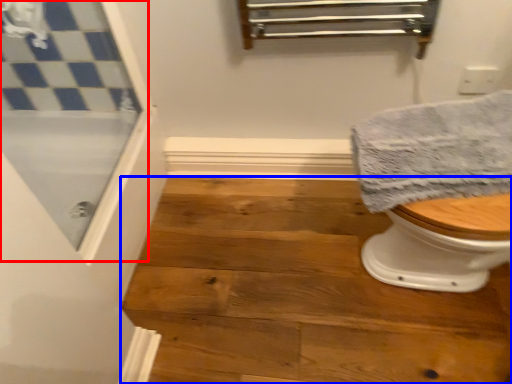
Question: Among these objects, which one is nearest to the camera, screen door (highlighted by a red box) or stair (highlighted by a blue box)?

Choices:
 (A) screen door
 (B) stair

Answer: (A)